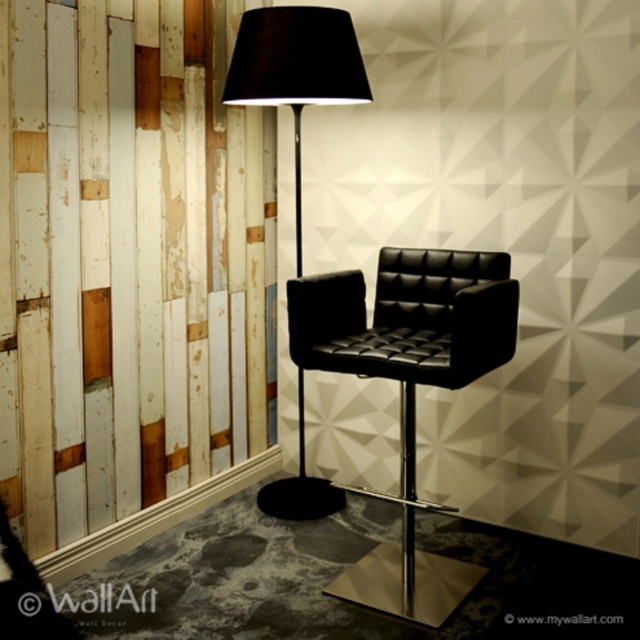
Question: Which point is closer to the camera taking this photo?

Choices:
 (A) (422, 342)
 (B) (257, 88)

Answer: (A)

Question: Which object appears farthest from the camera in this image?

Choices:
 (A) black matte floor lamp at center
 (B) black leather armchair at center

Answer: (A)

Question: Where is black leather armchair at center located in relation to black matte floor lamp at center in the image?

Choices:
 (A) left
 (B) right

Answer: (B)

Question: Is black leather armchair at center to the left of black matte floor lamp at center from the viewer's perspective?

Choices:
 (A) no
 (B) yes

Answer: (A)

Question: Can you confirm if black leather armchair at center is positioned to the right of black matte floor lamp at center?

Choices:
 (A) no
 (B) yes

Answer: (B)